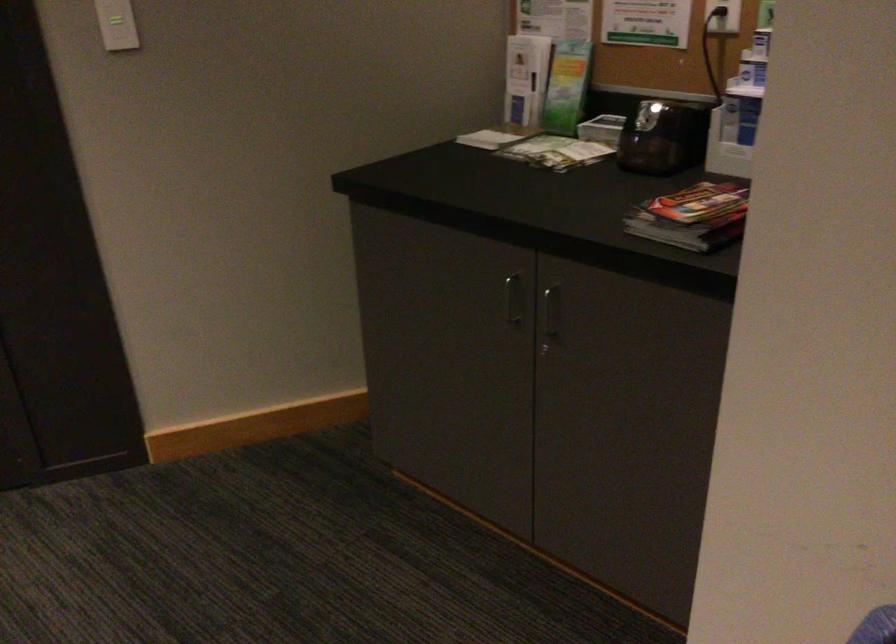
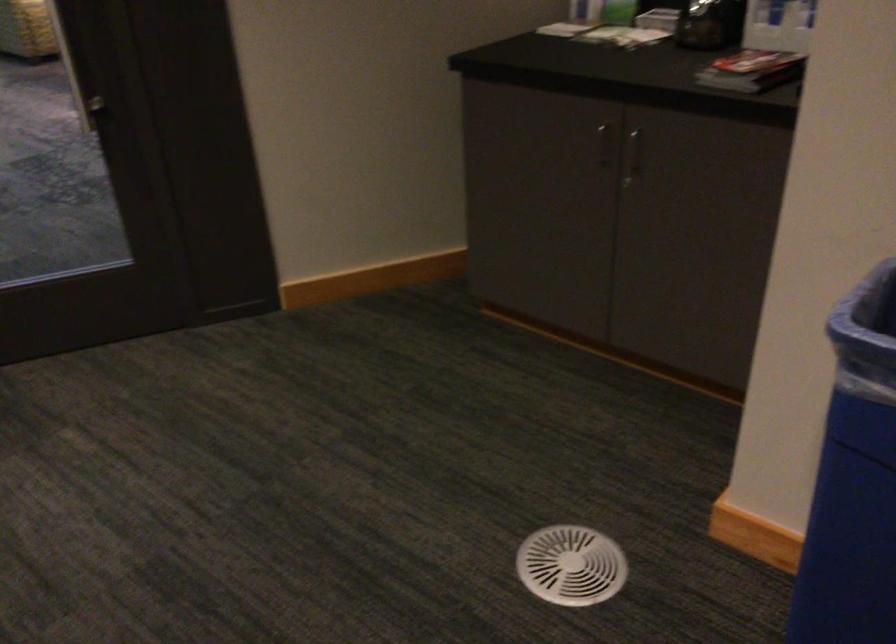
In the second image, find the point that corresponds to (x=552, y=319) in the first image.

(633, 155)